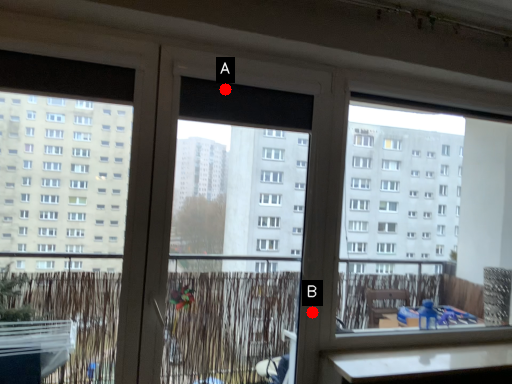
Question: Two points are circled on the image, labeled by A and B beside each circle. Which point appears farthest from the camera in this image?

Choices:
 (A) A is further
 (B) B is further

Answer: (B)